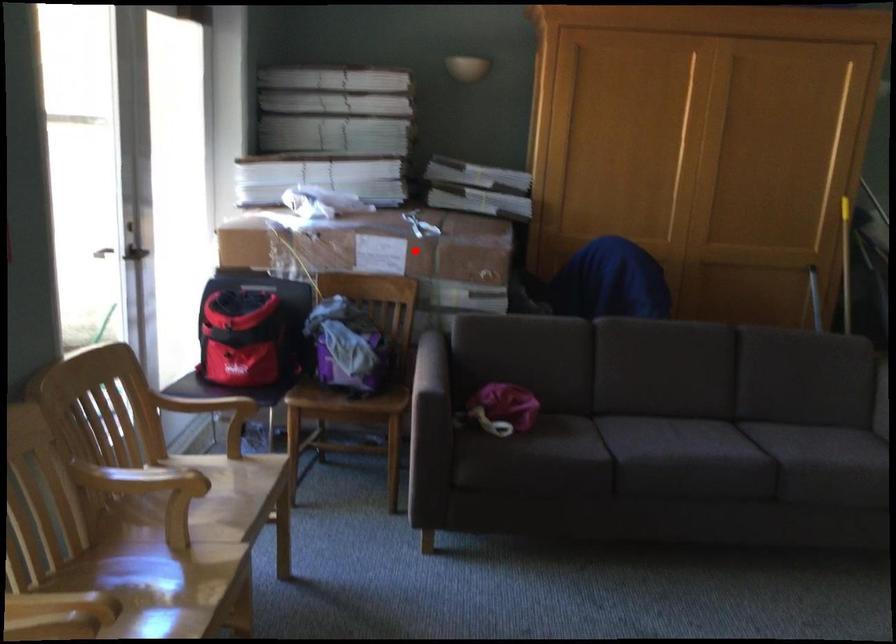
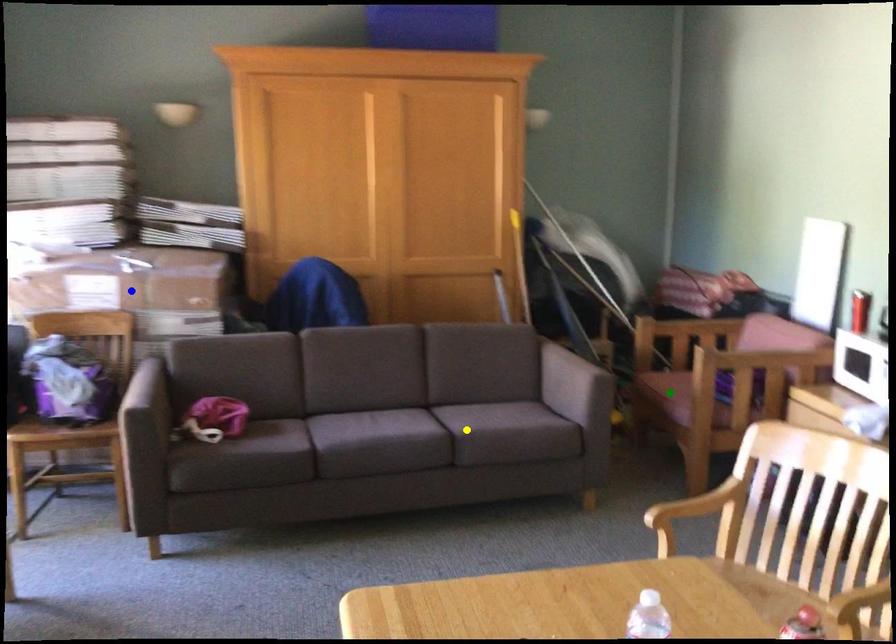
Question: I am providing you with two images of the same scene from different viewpoints. A red point is marked on the first image. You are given multiple points on the second image. Which point in image 2 is actually the same real-world point as the red point in image 1?

Choices:
 (A) yellow point
 (B) blue point
 (C) green point

Answer: (B)